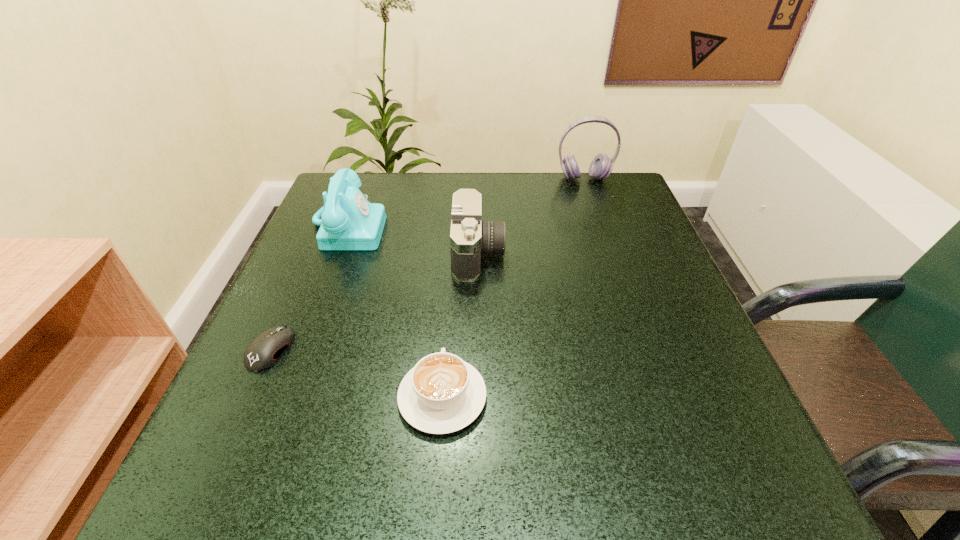
Locate an element on the screen. This screenshot has height=540, width=960. vacant space that satisfies the following two spatial constraints: 1. on the front-facing side of the camera; 2. on the front side of the shortest object is located at coordinates (478, 349).